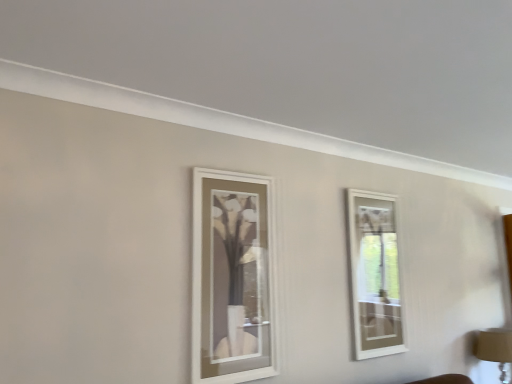
Describe the element at coordinates (494, 347) in the screenshot. I see `beige fabric lampshade at lower right` at that location.

Where is `beige fabric lampshade at lower right`? This screenshot has width=512, height=384. beige fabric lampshade at lower right is located at coordinates (494, 347).

The width and height of the screenshot is (512, 384). What are the coordinates of `beige fabric lampshade at lower right` in the screenshot? It's located at (494, 347).